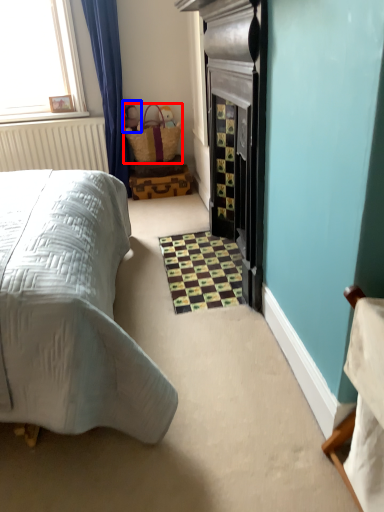
Question: Which point is further to the camera, basket (highlighted by a red box) or toy (highlighted by a blue box)?

Choices:
 (A) basket
 (B) toy

Answer: (B)